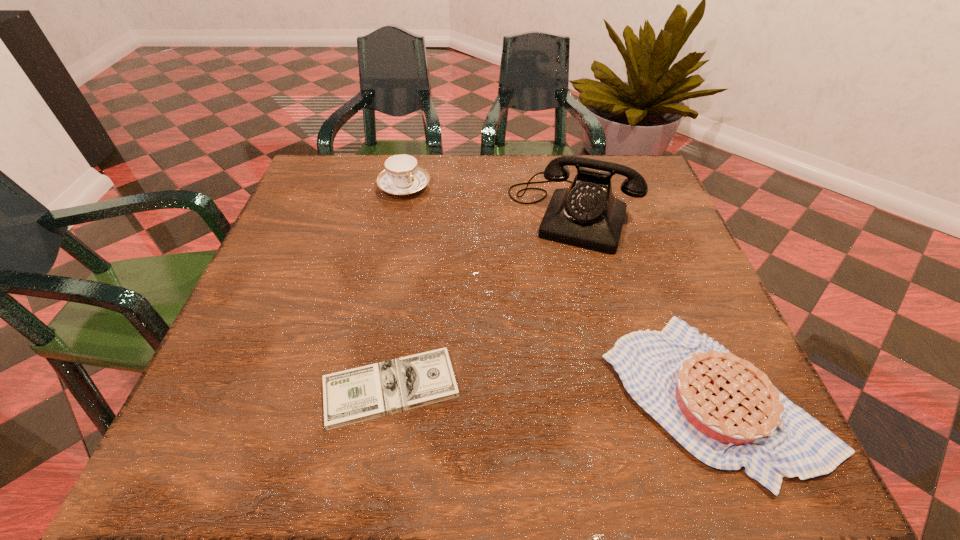
The height and width of the screenshot is (540, 960). In order to click on free space that is in between the tallest object and the third tallest object in this screenshot , I will do `click(643, 305)`.

You are a GUI agent. You are given a task and a screenshot of the screen. Output one action in this format:
    pyautogui.click(x=<x>, y=<y>)
    Task: Click on the vacant area between the dollar and the second tallest object
    The image size is (960, 540).
    Given the screenshot: What is the action you would take?
    pyautogui.click(x=397, y=288)

The height and width of the screenshot is (540, 960). What are the coordinates of `free space between the pie and the dollar` in the screenshot? It's located at (552, 392).

Find the location of a particular element. free point between the shortest object and the pie is located at coordinates (x=552, y=392).

Locate an element on the screen. This screenshot has height=540, width=960. vacant space in between the telephone and the pie is located at coordinates (643, 305).

Identify the location of vacant region between the pie and the shortest object. Image resolution: width=960 pixels, height=540 pixels. (552, 392).

Choose which object is the nearest neighbor to the shortest object. Please provide its 2D coordinates. Your answer should be formatted as a tuple, i.e. [(x, y)], where the tuple contains the x and y coordinates of a point satisfying the conditions above.

[(725, 411)]

Identify which object is located as the second nearest to the third shortest object. Please provide its 2D coordinates. Your answer should be formatted as a tuple, i.e. [(x, y)], where the tuple contains the x and y coordinates of a point satisfying the conditions above.

[(355, 395)]

Image resolution: width=960 pixels, height=540 pixels. I want to click on free space that satisfies the following two spatial constraints: 1. on the front side of the teacup; 2. on the right side of the tallest object, so click(398, 214).

Identify the location of free space that satisfies the following two spatial constraints: 1. on the back side of the tallest object; 2. on the right side of the dollar. (419, 214).